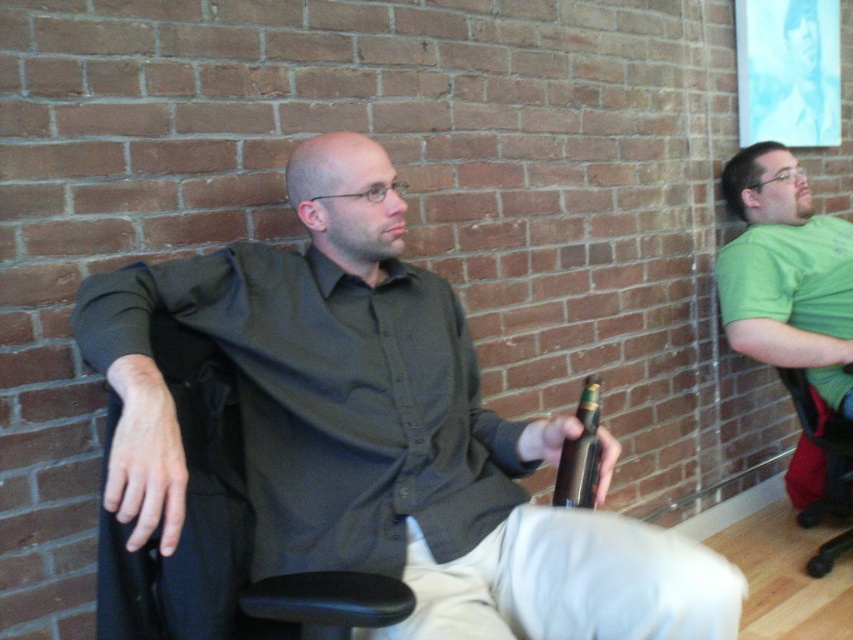
Does dark green button-up shirt at center appear on the left side of brown metallic bottle at center?

Yes, dark green button-up shirt at center is to the left of brown metallic bottle at center.

Find the location of a particular element. The height and width of the screenshot is (640, 853). dark green button-up shirt at center is located at coordinates (331, 401).

Identify the location of dark green button-up shirt at center. (331, 401).

Between point (819, 326) and point (596, 419), which one is positioned behind?

The point (819, 326) is behind.

Identify the location of green matte shirt at right. Image resolution: width=853 pixels, height=640 pixels. click(x=786, y=273).

Does black leather swivel chair at left appear on the left side of green matte shirt at right?

Indeed, black leather swivel chair at left is positioned on the left side of green matte shirt at right.

Is black leather swivel chair at left above green matte shirt at right?

Result: No.

Between point (306, 589) and point (780, 221), which one is positioned in front?

Point (306, 589) is more forward.

This screenshot has height=640, width=853. What are the coordinates of `black leather swivel chair at left` in the screenshot? It's located at (219, 534).